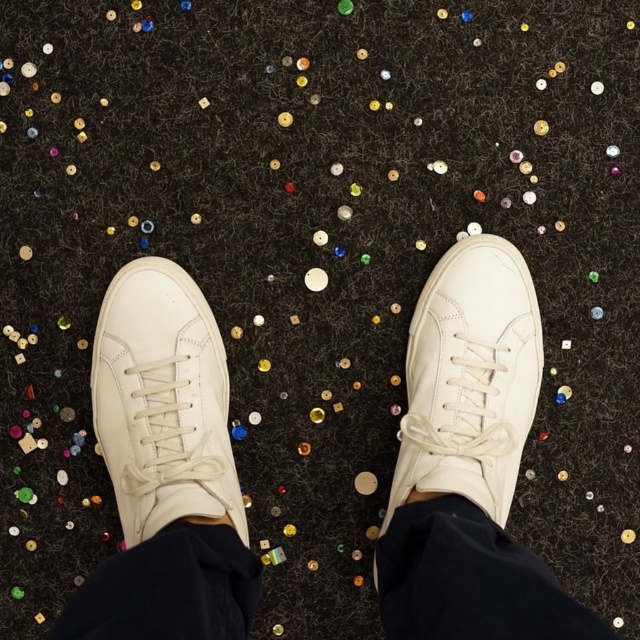
Who is more forward, (493, 372) or (113, 388)?

Point (113, 388)

Does white leather sneakers at center have a smaller size compared to white leather sneaker at left?

Actually, white leather sneakers at center might be larger than white leather sneaker at left.

Image resolution: width=640 pixels, height=640 pixels. Describe the element at coordinates (468, 461) in the screenshot. I see `white leather sneakers at center` at that location.

Locate an element on the screen. This screenshot has width=640, height=640. white leather sneakers at center is located at coordinates (468, 461).

Can you confirm if white leather sneaker at left is positioned above white leather sneaker at center?

Actually, white leather sneaker at left is below white leather sneaker at center.

Which is behind, point (129, 280) or point (429, 320)?

Positioned behind is point (429, 320).

Is point (189, 449) behind point (445, 276)?

No, (189, 449) is closer to viewer.

You are a GUI agent. You are given a task and a screenshot of the screen. Output one action in this format:
    pyautogui.click(x=<x>, y=<y>)
    Task: Click on the white leather sneaker at left
    The width and height of the screenshot is (640, 640).
    Given the screenshot: What is the action you would take?
    pyautogui.click(x=163, y=403)

Who is more distant from viewer, [385,618] or [528,419]?

Positioned behind is point [528,419].

Does point (413, 444) come closer to viewer compared to point (500, 440)?

No, (413, 444) is further to viewer.

At what (x,y) coordinates should I click in order to perform the action: click on white leather sneakers at center. Please return your answer as a coordinate pair (x, y). This screenshot has height=640, width=640. Looking at the image, I should click on (468, 461).